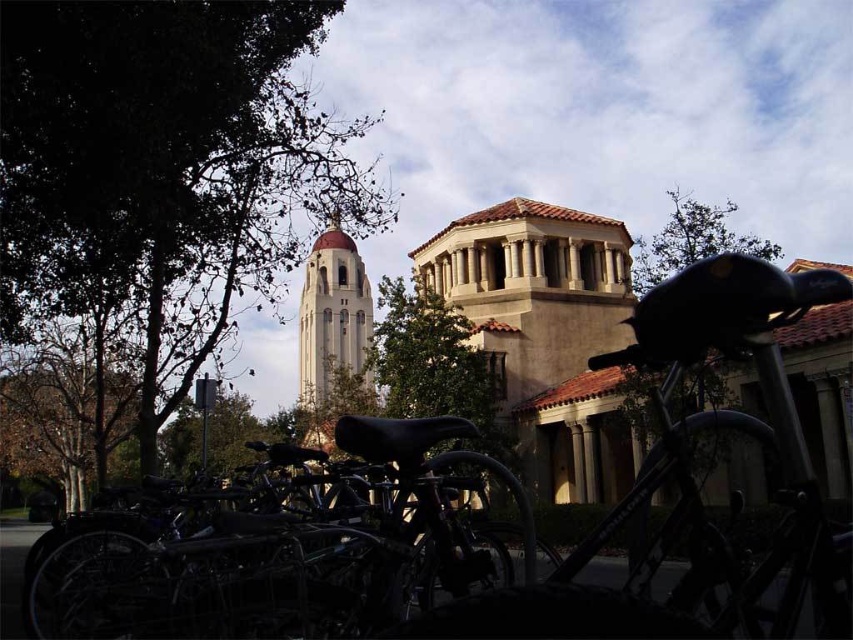
Question: Does shiny black bicycle at lower center have a lesser width compared to smooth beige tower at center?

Choices:
 (A) yes
 (B) no

Answer: (A)

Question: Is shiny black bicycle at center to the left of shiny black bicycle at lower center from the viewer's perspective?

Choices:
 (A) no
 (B) yes

Answer: (A)

Question: Does smooth beige tower at center have a greater width compared to green leafy tree at upper right?

Choices:
 (A) no
 (B) yes

Answer: (A)

Question: Which of the following is the closest to the observer?

Choices:
 (A) shiny black bicycle at lower center
 (B) green leafy tree at center
 (C) green leafy tree at upper right

Answer: (A)

Question: Considering the real-world distances, which object is closest to the shiny black bicycle at lower center?

Choices:
 (A) green leafy tree at center
 (B) smooth beige tower at center

Answer: (A)

Question: Estimate the real-world distances between objects in this image. Which object is farther from the shiny black bicycle at center?

Choices:
 (A) green leafy tree at upper right
 (B) green leafy tree at upper left
 (C) smooth beige tower at center
 (D) shiny black bicycle at lower center

Answer: (C)